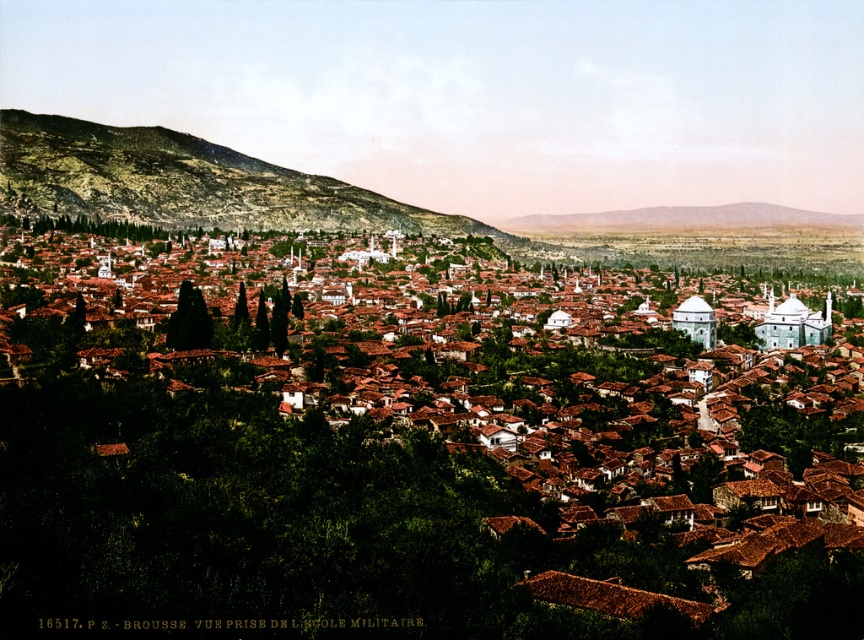
You are a tourist standing at the top of the green grassy hillside at left looking down. Which direction should you walk to reach the brown clay rooftops at center?

You should walk downward towards the brown clay rooftops at center since they are located below the green grassy hillside at left.

In the scene shown: You are a city planner analyzing the urban layout. Based on the scene, which area occupies more horizontal space between the brown clay rooftops at center and the green grassy hillside at left?

The green grassy hillside at left has a greater width than the brown clay rooftops at center, meaning the hillside occupies more horizontal space.